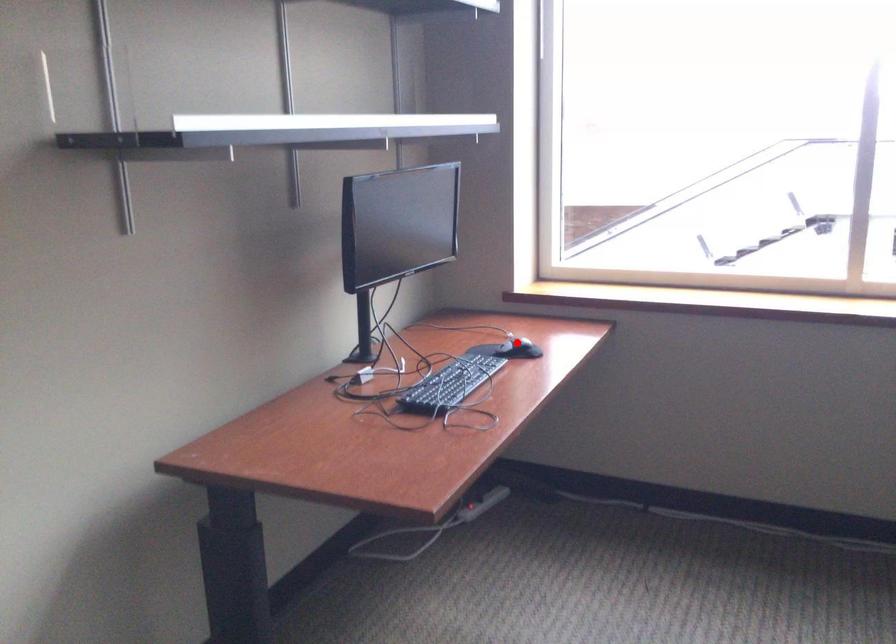
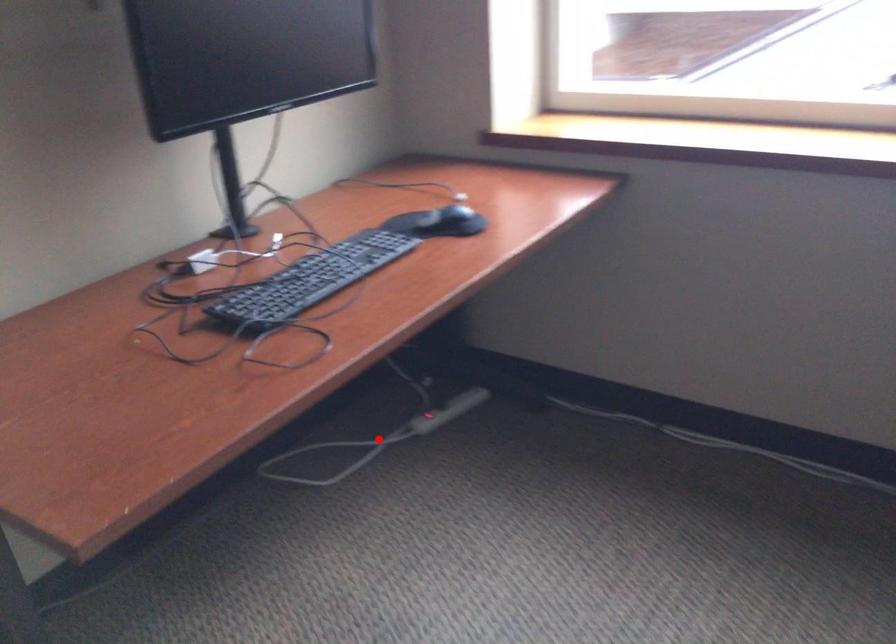
I am providing you with two images of the same scene from different viewpoints. A red point is marked on the first image and another point is marked on the second image. Does the point marked in image1 correspond to the same location as the one in image2?

No